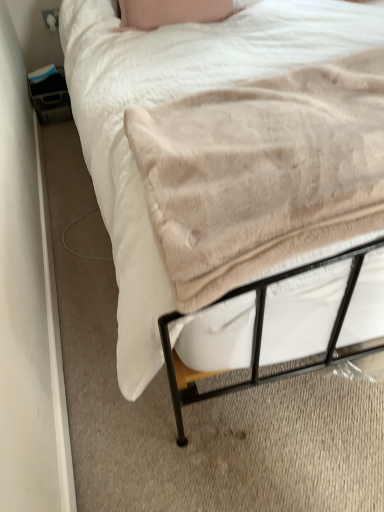
Question: Does beige plush blanket at center have a larger size compared to beige soft blanket at lower left?

Choices:
 (A) yes
 (B) no

Answer: (B)

Question: Considering the relative sizes of beige plush blanket at center and beige soft blanket at lower left in the image provided, is beige plush blanket at center thinner than beige soft blanket at lower left?

Choices:
 (A) yes
 (B) no

Answer: (A)

Question: Could beige soft blanket at lower left be considered to be inside beige plush blanket at center?

Choices:
 (A) yes
 (B) no

Answer: (B)

Question: Is beige plush blanket at center at the right side of beige soft blanket at lower left?

Choices:
 (A) no
 (B) yes

Answer: (B)

Question: Is beige plush blanket at center further to camera compared to beige soft blanket at lower left?

Choices:
 (A) yes
 (B) no

Answer: (B)

Question: Considering the relative positions of beige plush blanket at center and beige soft blanket at lower left in the image provided, is beige plush blanket at center in front of beige soft blanket at lower left?

Choices:
 (A) yes
 (B) no

Answer: (A)

Question: Could you tell me if beige soft blanket at lower left is facing beige plush blanket at center?

Choices:
 (A) no
 (B) yes

Answer: (A)

Question: Is beige soft blanket at lower left turned away from beige plush blanket at center?

Choices:
 (A) no
 (B) yes

Answer: (A)

Question: Is beige soft blanket at lower left further to camera compared to beige plush blanket at center?

Choices:
 (A) yes
 (B) no

Answer: (A)

Question: Is beige soft blanket at lower left at the left side of beige plush blanket at center?

Choices:
 (A) no
 (B) yes

Answer: (B)

Question: Considering the relative sizes of beige soft blanket at lower left and beige plush blanket at center in the image provided, is beige soft blanket at lower left smaller than beige plush blanket at center?

Choices:
 (A) yes
 (B) no

Answer: (B)

Question: Is beige soft blanket at lower left located outside beige plush blanket at center?

Choices:
 (A) yes
 (B) no

Answer: (A)

Question: Is point click(x=218, y=28) positioned closer to the camera than point click(x=349, y=226)?

Choices:
 (A) farther
 (B) closer

Answer: (A)